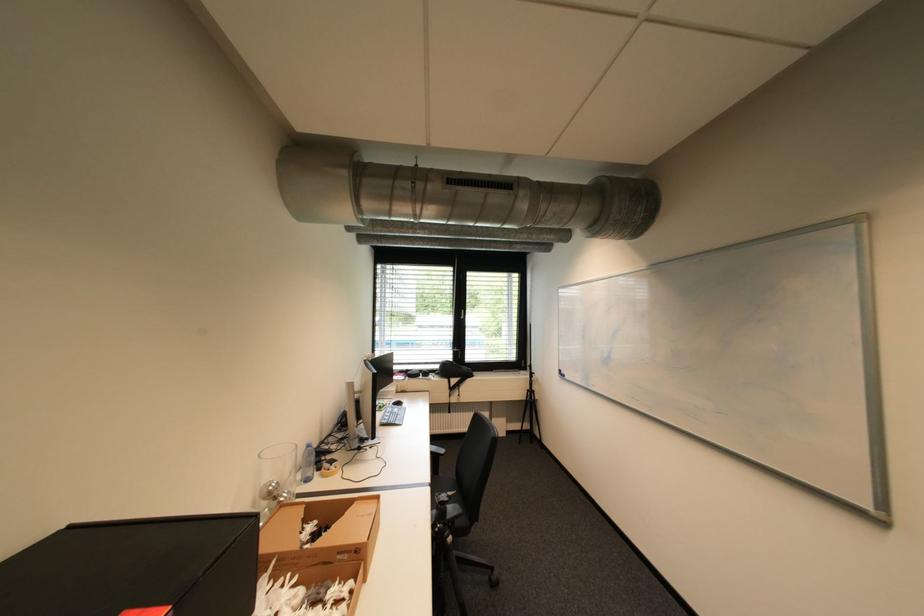
The image size is (924, 616). In order to click on black chair armrest in this screenshot , I will do `click(464, 549)`.